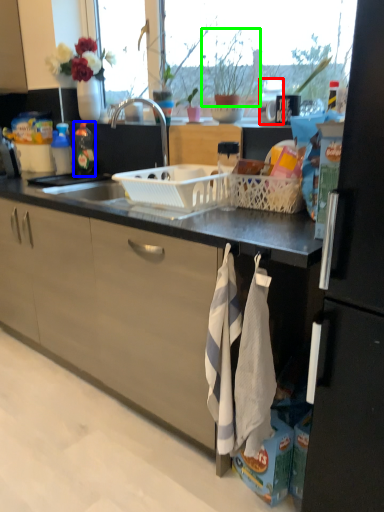
Question: Which is farther away from appliance (highlighted by a red box)? kitchen appliance (highlighted by a blue box) or houseplant (highlighted by a green box)?

Choices:
 (A) kitchen appliance
 (B) houseplant

Answer: (A)